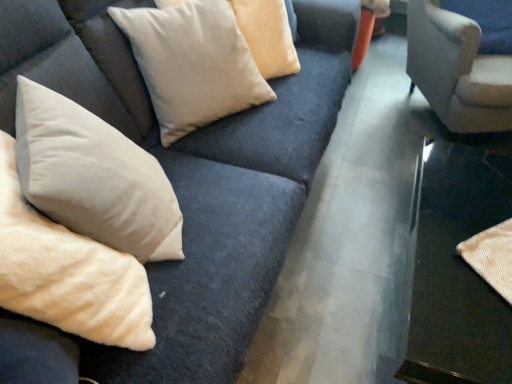
Question: Considering their positions, is velvet beige pillows at upper left located in front of or behind white soft pillow at lower left, the 1th pillow from the front?

Choices:
 (A) behind
 (B) front

Answer: (A)

Question: From the image's perspective, relative to white soft pillow at lower left, the second pillow viewed from the back, is velvet beige pillows at upper left above or below?

Choices:
 (A) above
 (B) below

Answer: (A)

Question: Estimate the real-world distances between objects in this image. Which object is farther from the suede gray chair at upper right?

Choices:
 (A) white soft pillow at lower left, the 1th pillow from the front
 (B) velvet beige pillows at upper left
 (C) metallic silver table at lower right
 (D) suede-like beige pillow at upper center, the first pillow viewed from the back

Answer: (A)

Question: Which object is the farthest from the white soft pillow at lower left, the second pillow viewed from the back?

Choices:
 (A) suede-like beige pillow at upper center, which ranks as the second pillow in front-to-back order
 (B) suede gray chair at upper right
 (C) metallic silver table at lower right
 (D) velvet beige pillows at upper left

Answer: (B)